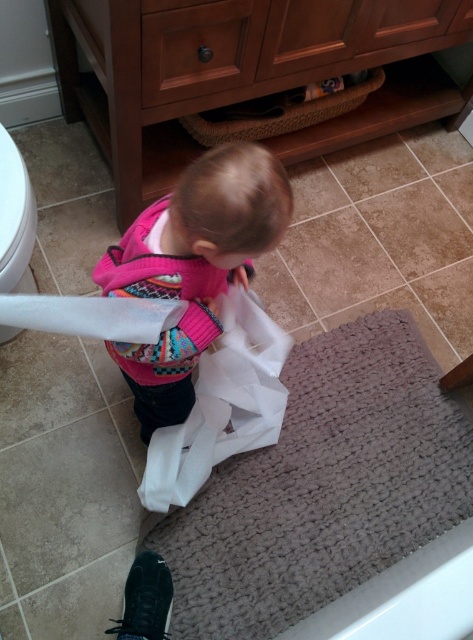
From the picture: Does white paper towel at lower left appear on the right side of white glossy toilet bowl at lower left?

Indeed, white paper towel at lower left is positioned on the right side of white glossy toilet bowl at lower left.

Is white paper towel at lower left taller than white glossy toilet bowl at lower left?

Incorrect, white paper towel at lower left's height is not larger of white glossy toilet bowl at lower left's.

The width and height of the screenshot is (473, 640). Describe the element at coordinates (92, 316) in the screenshot. I see `white paper towel at lower left` at that location.

At what (x,y) coordinates should I click in order to perform the action: click on white paper towel at lower left. Please return your answer as a coordinate pair (x, y). Looking at the image, I should click on (92, 316).

Locate an element on the screen. The image size is (473, 640). pink knitted sweater at center is located at coordinates (192, 268).

Is pink knitted sweater at center in front of white glossy toilet paper at center?

Yes, pink knitted sweater at center is in front of white glossy toilet paper at center.

Is point (152, 372) more distant than point (173, 429)?

No, it is not.

Where is `pink knitted sweater at center`? The width and height of the screenshot is (473, 640). pink knitted sweater at center is located at coordinates (192, 268).

Which is more to the right, white glossy toilet paper at center or white paper towel at lower left?

white glossy toilet paper at center

Measure the distance between point [185,467] and camera.

The distance of point [185,467] from camera is 3.98 feet.

Which is behind, point (257, 442) or point (64, 332)?

Positioned behind is point (257, 442).

This screenshot has width=473, height=640. Identify the location of white glossy toilet paper at center. (221, 404).